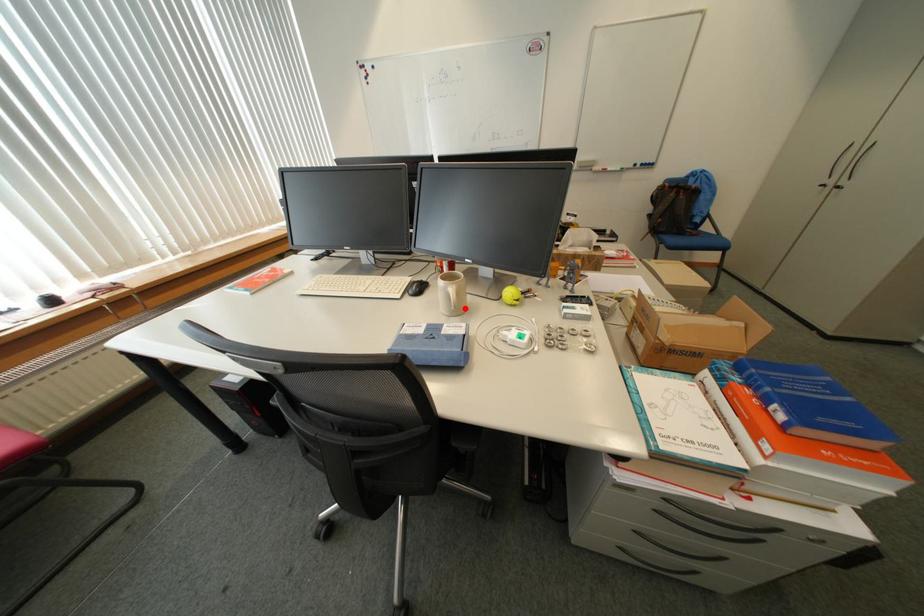
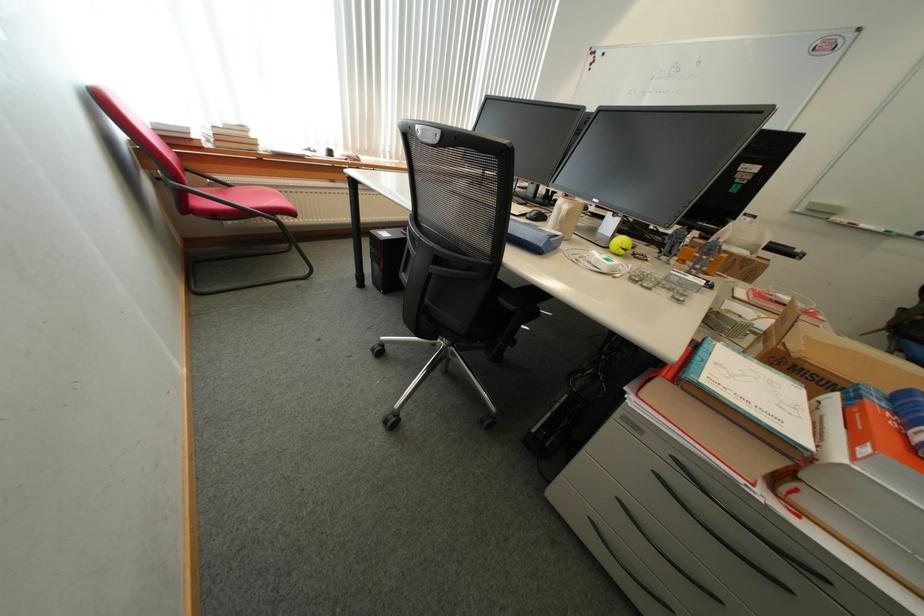
Where in the second image is the point corresponding to the highlighted location from the first image?

(570, 223)